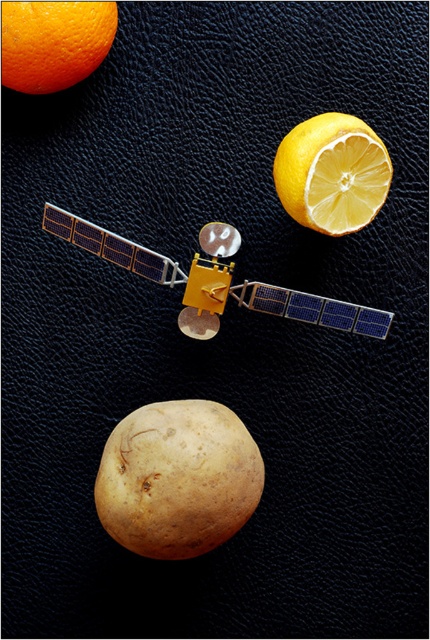
You are looking at the image and want to know which of the two points, point (245, 467) or point (70, 76), is closer to the camera. Can you determine this based on their positions?

Point (245, 467) is further to the camera than point (70, 76). Therefore, point (70, 76) is closer to the camera.